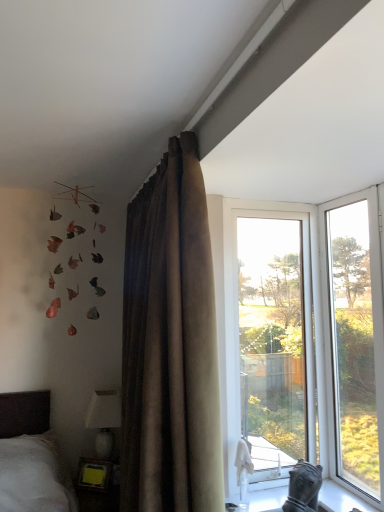
The width and height of the screenshot is (384, 512). What do you see at coordinates (274, 336) in the screenshot?
I see `transparent glass window at center, which is counted as the second window, starting from the right` at bounding box center [274, 336].

You are a GUI agent. You are given a task and a screenshot of the screen. Output one action in this format:
    pyautogui.click(x=<x>, y=<y>)
    Task: Click on the transparent glass window at center, which is counted as the second window, starting from the right
    
    Given the screenshot: What is the action you would take?
    pyautogui.click(x=274, y=336)

The width and height of the screenshot is (384, 512). What do you see at coordinates (104, 420) in the screenshot? I see `white glossy lampshade at lower left` at bounding box center [104, 420].

This screenshot has width=384, height=512. What do you see at coordinates (340, 499) in the screenshot?
I see `white glossy stone at lower right` at bounding box center [340, 499].

At what (x,y) coordinates should I click in order to perform the action: click on transparent glass window at right, arranged as the first window when viewed from the right. Please return your answer as a coordinate pair (x, y). Looking at the image, I should click on (354, 337).

Locate an element on the screen. transparent glass window at center, which is counted as the second window, starting from the right is located at coordinates (274, 336).

Does point (370, 448) come farther from viewer compared to point (106, 509)?

That is False.

This screenshot has height=512, width=384. In order to click on table behind the transparent glass window at right, arranged as the first window when viewed from the right in this screenshot , I will do `click(96, 486)`.

Can you tell me how much transparent glass window at right, the 2th window in the left-to-right sequence, and wooden frame at lower left differ in facing direction?

They differ by 54.5 degrees in their facing directions.

Is transparent glass window at right, arranged as the first window when viewed from the right, bigger than wooden frame at lower left?

Yes, transparent glass window at right, arranged as the first window when viewed from the right, is bigger than wooden frame at lower left.

Is white glossy stone at lower right positioned with its back to brown velvet curtain at upper center?

No.

From a real-world perspective, which object rests below the other?

From a 3D spatial view, white glossy stone at lower right is below.

Based on the photo, between white glossy stone at lower right and brown velvet curtain at upper center, which one appears on the right side from the viewer's perspective?

Positioned to the right is white glossy stone at lower right.

From the image's perspective, is transparent glass window at center, which is counted as the second window, starting from the right, under wooden frame at lower left?

Actually, transparent glass window at center, which is counted as the second window, starting from the right, appears above wooden frame at lower left in the image.

Where is `the 1st window to the right of the wooden frame at lower left, counting from the anchor's position`? The image size is (384, 512). the 1st window to the right of the wooden frame at lower left, counting from the anchor's position is located at coordinates (274, 336).

Considering the positions of objects transparent glass window at center, which ranks as the first window in left-to-right order, and wooden frame at lower left in the image provided, who is more to the right, transparent glass window at center, which ranks as the first window in left-to-right order, or wooden frame at lower left?

Positioned to the right is transparent glass window at center, which ranks as the first window in left-to-right order.

Is transparent glass window at center, which ranks as the first window in left-to-right order, thinner than wooden frame at lower left?

No, transparent glass window at center, which ranks as the first window in left-to-right order, is not thinner than wooden frame at lower left.

Looking at this image, what's the angular difference between transparent glass window at center, which ranks as the first window in left-to-right order, and white glossy stone at lower right's facing directions?

transparent glass window at center, which ranks as the first window in left-to-right order, and white glossy stone at lower right are facing 89.5 degrees away from each other.

Which is correct: transparent glass window at center, which is counted as the second window, starting from the right, is inside white glossy stone at lower right, or outside of it?

transparent glass window at center, which is counted as the second window, starting from the right, is located beyond the bounds of white glossy stone at lower right.

Which is behind, transparent glass window at center, which ranks as the first window in left-to-right order, or white glossy stone at lower right?

transparent glass window at center, which ranks as the first window in left-to-right order, is more distant.

Considering the sizes of objects transparent glass window at center, which ranks as the first window in left-to-right order, and white glossy stone at lower right in the image provided, who is bigger, transparent glass window at center, which ranks as the first window in left-to-right order, or white glossy stone at lower right?

transparent glass window at center, which ranks as the first window in left-to-right order.

Which point is more distant from viewer, (89, 511) or (379, 374)?

Positioned behind is point (89, 511).

Is wooden frame at lower left next to transparent glass window at right, the 2th window in the left-to-right sequence?

No.

From a real-world perspective, relative to transparent glass window at right, arranged as the first window when viewed from the right, is wooden frame at lower left vertically above or below?

wooden frame at lower left is below transparent glass window at right, arranged as the first window when viewed from the right.

From the image's perspective, is wooden frame at lower left located above or below transparent glass window at right, the 2th window in the left-to-right sequence?

Clearly, from the image's perspective, wooden frame at lower left is below transparent glass window at right, the 2th window in the left-to-right sequence.

In the image, there is a transparent glass window at center, which ranks as the first window in left-to-right order. Where is `table below it (from the image's perspective)`? table below it (from the image's perspective) is located at coordinates (96, 486).

Is wooden frame at lower left oriented away from transparent glass window at center, which is counted as the second window, starting from the right?

That's not correct — wooden frame at lower left is not looking away from transparent glass window at center, which is counted as the second window, starting from the right.

Looking at this image, from the image's perspective, is wooden frame at lower left on top of transparent glass window at center, which ranks as the first window in left-to-right order?

No.

Does wooden frame at lower left have a greater width compared to transparent glass window at center, which is counted as the second window, starting from the right?

No.

From the image's perspective, which one is positioned lower, white glossy lampshade at lower left or transparent glass window at right, arranged as the first window when viewed from the right?

white glossy lampshade at lower left appears lower in the image.

Consider the image. How much distance is there between white glossy lampshade at lower left and transparent glass window at right, arranged as the first window when viewed from the right?

The distance of white glossy lampshade at lower left from transparent glass window at right, arranged as the first window when viewed from the right, is 1.48 meters.

From a real-world perspective, is white glossy lampshade at lower left on top of transparent glass window at right, the 2th window in the left-to-right sequence?

Actually, white glossy lampshade at lower left is physically below transparent glass window at right, the 2th window in the left-to-right sequence, in the real world.

Looking at the image, does white glossy lampshade at lower left seem bigger or smaller compared to transparent glass window at right, arranged as the first window when viewed from the right?

white glossy lampshade at lower left is smaller than transparent glass window at right, arranged as the first window when viewed from the right.

The width and height of the screenshot is (384, 512). I want to click on table below the transparent glass window at right, the 2th window in the left-to-right sequence (from the image's perspective), so click(96, 486).

The image size is (384, 512). I want to click on window sill below the brown velvet curtain at upper center (from a real-world perspective), so click(340, 499).

Based on their spatial positions, is white glossy stone at lower right or wooden frame at lower left closer to transparent glass window at right, the 2th window in the left-to-right sequence?

Based on the image, white glossy stone at lower right appears to be nearer to transparent glass window at right, the 2th window in the left-to-right sequence.

Estimate the real-world distances between objects in this image. Which object is closer to transparent glass window at right, arranged as the first window when viewed from the right, white glossy lampshade at lower left or brown velvet curtain at upper center?

Based on the image, brown velvet curtain at upper center appears to be nearer to transparent glass window at right, arranged as the first window when viewed from the right.

Estimate the real-world distances between objects in this image. Which object is further from brown velvet curtain at upper center, transparent glass window at right, arranged as the first window when viewed from the right, or white glossy lampshade at lower left?

white glossy lampshade at lower left is positioned further to the anchor brown velvet curtain at upper center.

Considering their positions, is wooden frame at lower left positioned further to brown velvet curtain at upper center than white glossy lampshade at lower left?

white glossy lampshade at lower left lies further to brown velvet curtain at upper center than the other object.

Estimate the real-world distances between objects in this image. Which object is closer to transparent glass window at center, which is counted as the second window, starting from the right, white glossy lampshade at lower left or transparent glass window at right, arranged as the first window when viewed from the right?

transparent glass window at right, arranged as the first window when viewed from the right, lies closer to transparent glass window at center, which is counted as the second window, starting from the right, than the other object.

Consider the image. From the image, which object appears to be nearer to wooden frame at lower left, white glossy stone at lower right or transparent glass window at center, which is counted as the second window, starting from the right?

white glossy stone at lower right is closer to wooden frame at lower left.

Looking at the image, which one is located closer to white glossy lampshade at lower left, brown velvet curtain at upper center or wooden frame at lower left?

Based on the image, wooden frame at lower left appears to be nearer to white glossy lampshade at lower left.

Based on their spatial positions, is transparent glass window at right, the 2th window in the left-to-right sequence, or white glossy stone at lower right further from white glossy lampshade at lower left?

transparent glass window at right, the 2th window in the left-to-right sequence, is further to white glossy lampshade at lower left.

Locate an element on the screen. window situated between brown velvet curtain at upper center and transparent glass window at right, the 2th window in the left-to-right sequence, from left to right is located at coordinates (274, 336).

This screenshot has width=384, height=512. I want to click on window between brown velvet curtain at upper center and white glossy stone at lower right in the horizontal direction, so click(274, 336).

The height and width of the screenshot is (512, 384). Identify the location of lamp between wooden frame at lower left and transparent glass window at center, which is counted as the second window, starting from the right, from left to right. (104, 420).

Where is `lamp between wooden frame at lower left and transparent glass window at right, arranged as the first window when viewed from the right`? This screenshot has width=384, height=512. lamp between wooden frame at lower left and transparent glass window at right, arranged as the first window when viewed from the right is located at coordinates pos(104,420).